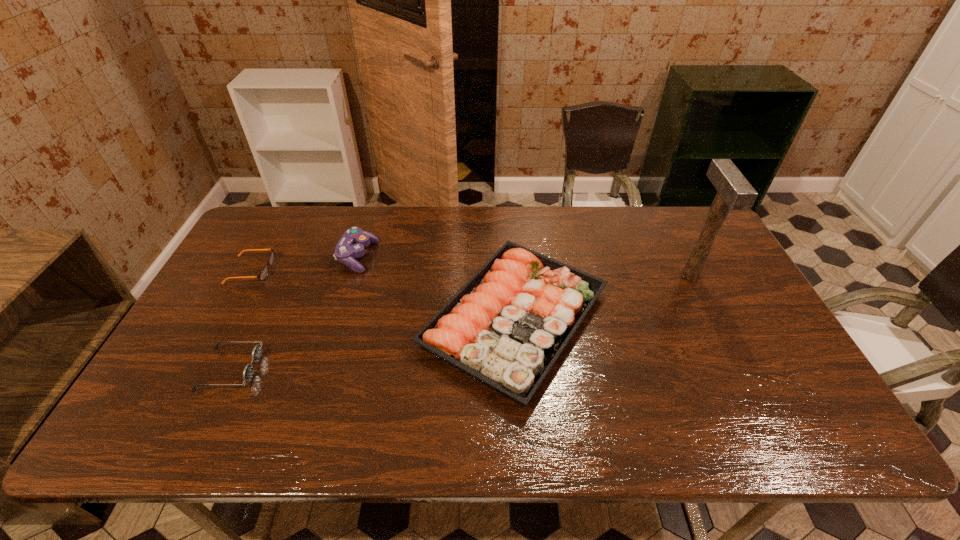
This screenshot has width=960, height=540. In order to click on free region at the far left corner of the desktop in this screenshot , I will do `click(266, 222)`.

At what (x,y) coordinates should I click in order to perform the action: click on vacant space at the far right corner of the desktop. Please return your answer as a coordinate pair (x, y). The image size is (960, 540). Looking at the image, I should click on (712, 246).

Identify the location of vacant space at the near right corner. (815, 427).

Where is `free space between the sunglasses and the control`? The image size is (960, 540). free space between the sunglasses and the control is located at coordinates click(x=294, y=313).

The height and width of the screenshot is (540, 960). I want to click on free point between the fourth tallest object and the spectacles, so click(x=241, y=320).

Image resolution: width=960 pixels, height=540 pixels. Find the location of `blank region between the shortest object and the third object from left to right`. blank region between the shortest object and the third object from left to right is located at coordinates (304, 264).

Image resolution: width=960 pixels, height=540 pixels. What are the coordinates of `unoccupied position between the third object from left to right and the platter` in the screenshot? It's located at (436, 288).

At what (x,y) coordinates should I click in order to perform the action: click on empty space that is in between the fourth object from left to right and the spectacles. Please return your answer as a coordinate pair (x, y). The width and height of the screenshot is (960, 540). Looking at the image, I should click on (383, 294).

Identify the location of vacant space that is in between the tallest object and the shortest object. (470, 273).

Where is `free spot between the control and the third tallest object`? This screenshot has width=960, height=540. free spot between the control and the third tallest object is located at coordinates (436, 288).